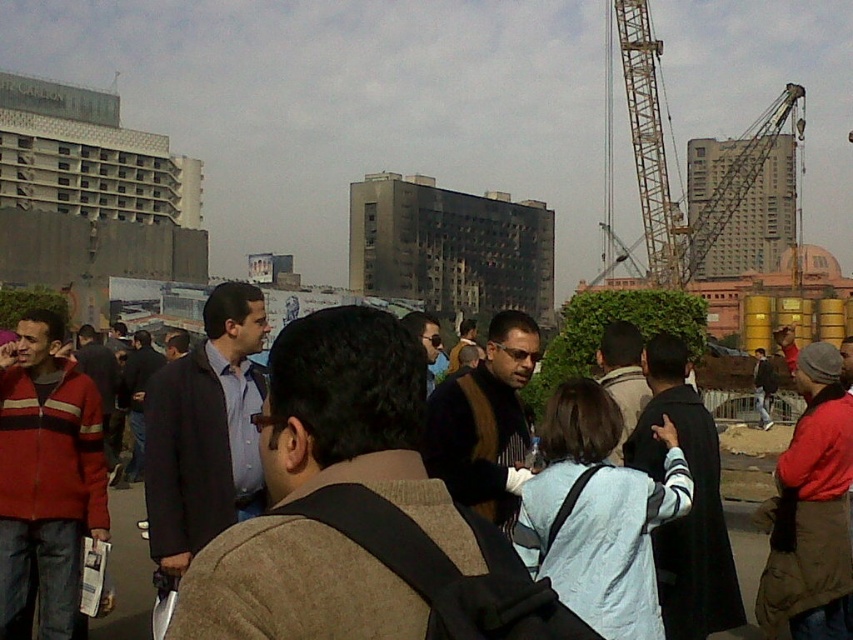
You are a photographer standing at point (206, 432) in the image. You notice a dark blue shirt at center. What is the color of the clothing item closest to your current position?

The dark blue shirt at center is located at point (206, 432), so the clothing item closest to your current position is the dark blue shirt at center.